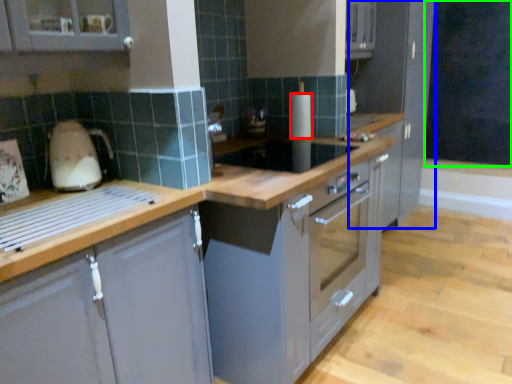
Question: Which is farther away from kitchen appliance (highlighted by a red box)? cabinetry (highlighted by a blue box) or dark (highlighted by a green box)?

Choices:
 (A) cabinetry
 (B) dark

Answer: (B)